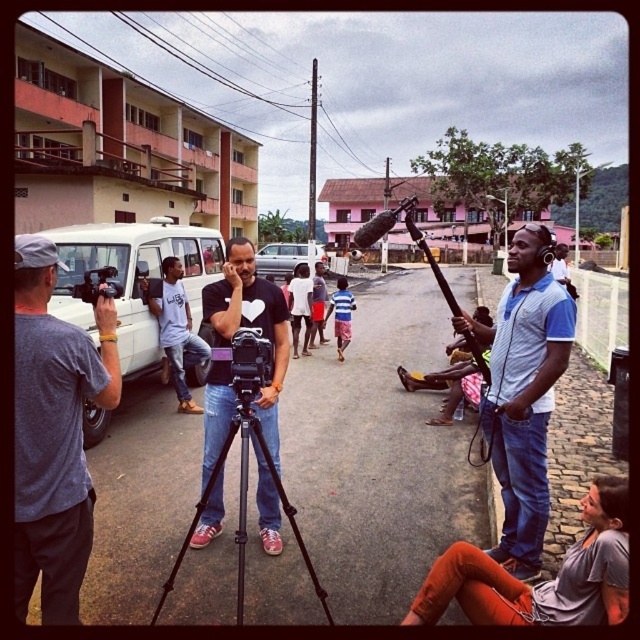
Question: Is orange denim pants at lower right smaller than white matte camera at center?

Choices:
 (A) no
 (B) yes

Answer: (B)

Question: Does orange denim pants at lower right appear over striped cotton shirt at center?

Choices:
 (A) yes
 (B) no

Answer: (B)

Question: Which of the following is the closest to the observer?

Choices:
 (A) light blue jeans at center
 (B) gray fabric camera at left
 (C) orange denim pants at lower right
 (D) black plastic camera at center

Answer: (C)

Question: Does gray fabric camera at left have a smaller size compared to black plastic camera at center?

Choices:
 (A) yes
 (B) no

Answer: (B)

Question: Which point is closer to the camera?

Choices:
 (A) (241, 540)
 (B) (116, 291)
 (C) (339, 342)

Answer: (B)

Question: Among these points, which one is farthest from the camera?

Choices:
 (A) (240, 353)
 (B) (241, 577)
 (C) (348, 312)

Answer: (C)